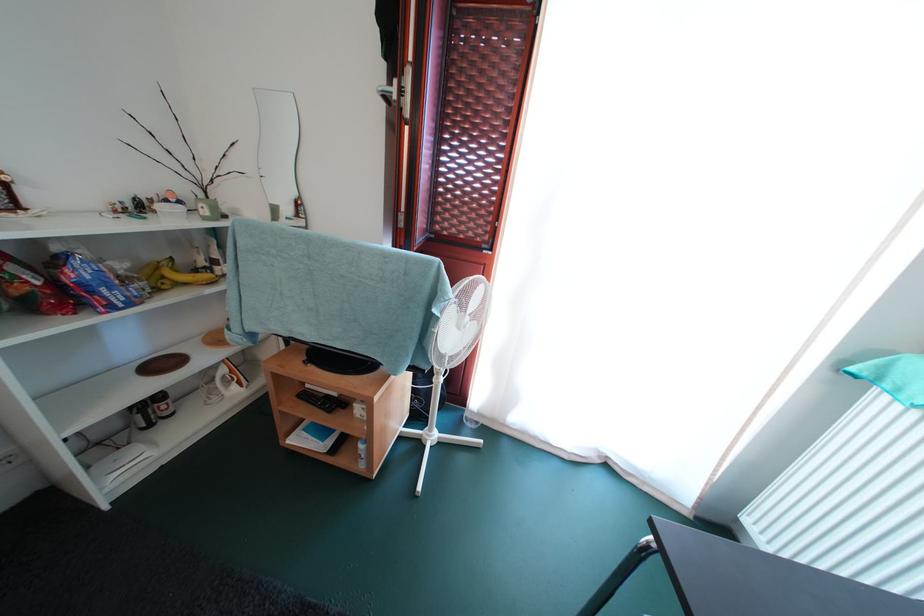
Where would you lift the black remote control? Please return your answer as a coordinate pair (x, y).

(317, 400)